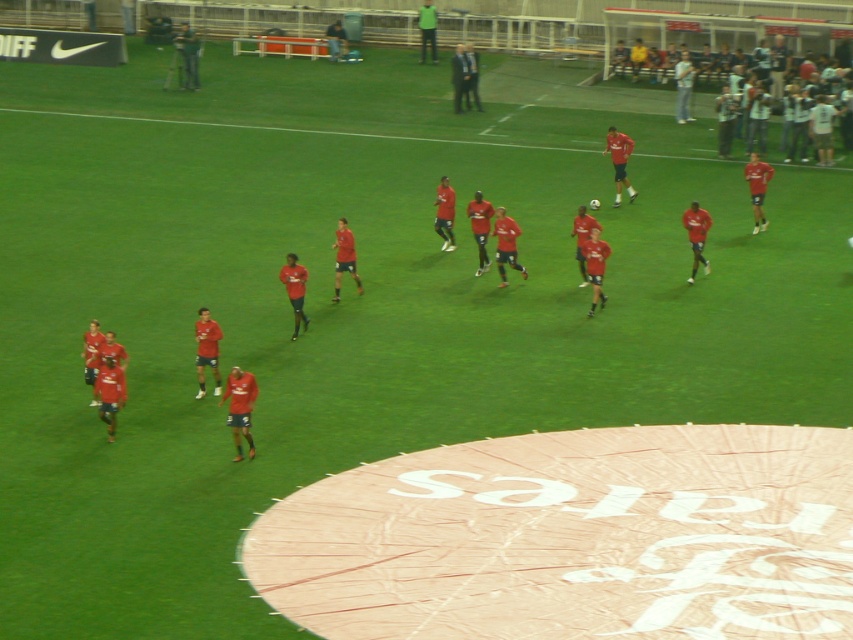
You are a photographer positioned at the edge of the soccer field. You need to capture a photo that includes both the dark gray suit at center and the green matte shirt at upper center. Based on their positions, which one should you adjust your camera to focus on first to ensure both are in frame?

The dark gray suit at center is to the right of the green matte shirt at upper center, so you should focus on the green matte shirt at upper center first to ensure both are included in the frame.

You are a photographer positioned at the center of the field. You need to capture a photo that includes both the matte red shirt at upper right and the dark blue jeans at center. Based on their positions, which direction should you move to ensure both subjects are in frame?

The matte red shirt at upper right is to the right of the dark blue jeans at center. To include both in your photo, you should move to the left so that the matte red shirt at upper right and dark blue jeans at center are within the frame.

You are a photographer positioned at the camera. You need to capture a closeup shot of the green matte shirt at upper center. Given that your zoom lens can focus clearly up to 40 meters, will you be able to capture a clear closeup without moving closer?

The green matte shirt at upper center is 41.07 meters away from the camera, which exceeds the 40 meters maximum focus distance of the zoom lens. Therefore, you cannot capture a clear closeup without moving closer.